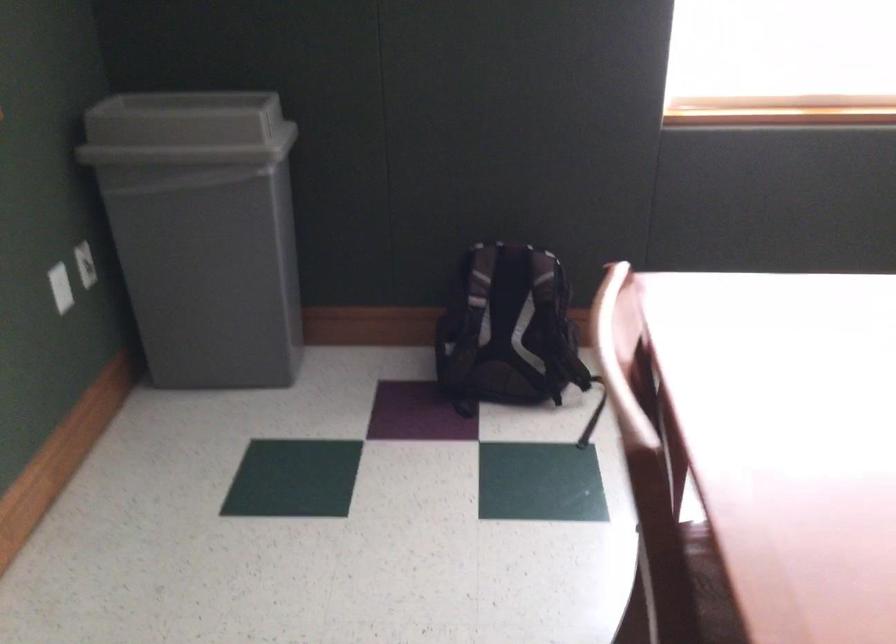
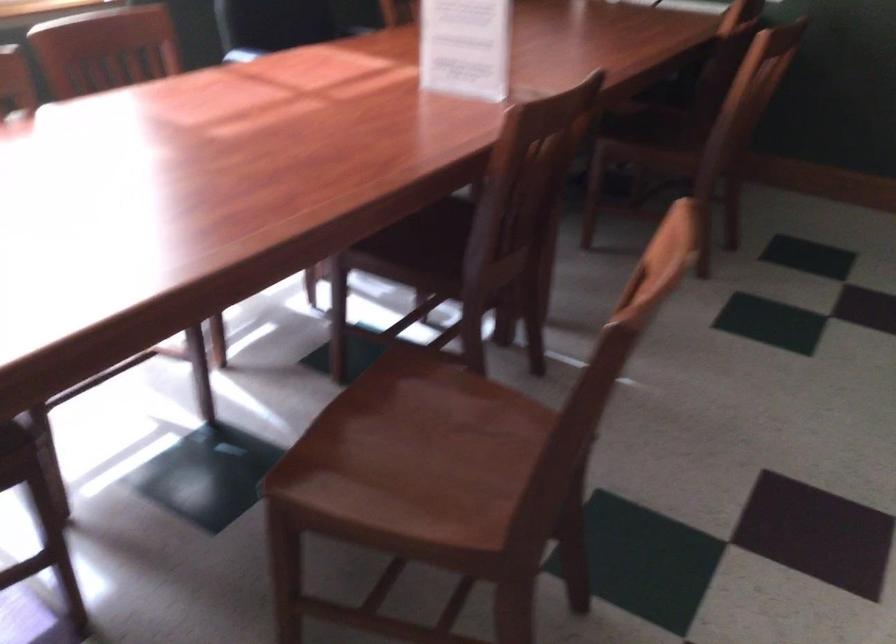
Question: The camera is either moving clockwise (left) or counter-clockwise (right) around the object. The first image is from the beginning of the video and the second image is from the end. Is the camera moving left or right when shooting the video?

Choices:
 (A) Left
 (B) Right

Answer: (A)